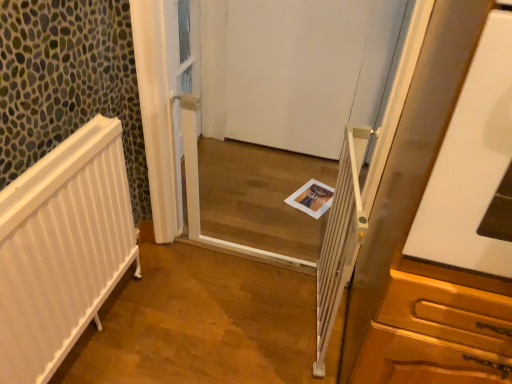
Question: Is white matte door at center smaller than white paper magazine at center?

Choices:
 (A) yes
 (B) no

Answer: (B)

Question: Is white matte door at center at the right side of white paper magazine at center?

Choices:
 (A) yes
 (B) no

Answer: (B)

Question: Is the depth of white matte door at center greater than that of white paper magazine at center?

Choices:
 (A) yes
 (B) no

Answer: (B)

Question: Is white matte door at center positioned with its back to white paper magazine at center?

Choices:
 (A) no
 (B) yes

Answer: (A)

Question: Is there a large distance between white matte door at center and white paper magazine at center?

Choices:
 (A) no
 (B) yes

Answer: (A)

Question: From their relative heights in the image, would you say white plastic screen door at center is taller or shorter than white matte door at center?

Choices:
 (A) short
 (B) tall

Answer: (B)

Question: Would you say white plastic screen door at center is to the left or to the right of white matte door at center in the picture?

Choices:
 (A) left
 (B) right

Answer: (A)

Question: Does point (327, 163) appear closer or farther from the camera than point (323, 124)?

Choices:
 (A) farther
 (B) closer

Answer: (A)

Question: From a real-world perspective, is white plastic screen door at center positioned above or below white matte door at center?

Choices:
 (A) below
 (B) above

Answer: (B)

Question: Looking at their shapes, would you say white paper magazine at center is wider or thinner than white plastic balustrade at center?

Choices:
 (A) wide
 (B) thin

Answer: (A)

Question: Considering the positions of white paper magazine at center and white plastic balustrade at center in the image, is white paper magazine at center bigger or smaller than white plastic balustrade at center?

Choices:
 (A) small
 (B) big

Answer: (A)

Question: Does point (297, 193) appear closer or farther from the camera than point (350, 223)?

Choices:
 (A) farther
 (B) closer

Answer: (A)

Question: From a real-world perspective, is white paper magazine at center positioned above or below white plastic balustrade at center?

Choices:
 (A) below
 (B) above

Answer: (A)

Question: Considering the positions of white paper magazine at center and white matte door at center in the image, is white paper magazine at center taller or shorter than white matte door at center?

Choices:
 (A) tall
 (B) short

Answer: (B)

Question: Is point (291, 200) closer or farther from the camera than point (318, 102)?

Choices:
 (A) farther
 (B) closer

Answer: (B)